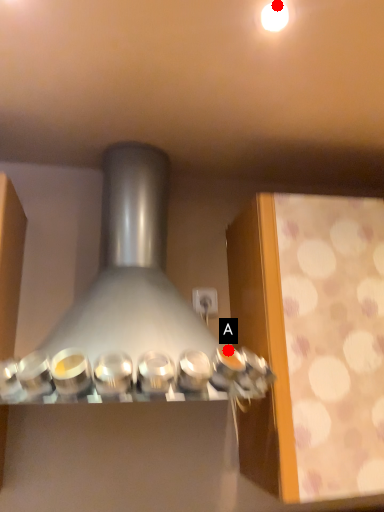
Question: Two points are circled on the image, labeled by A and B beside each circle. Among these points, which one is farthest from the camera?

Choices:
 (A) A is further
 (B) B is further

Answer: (A)